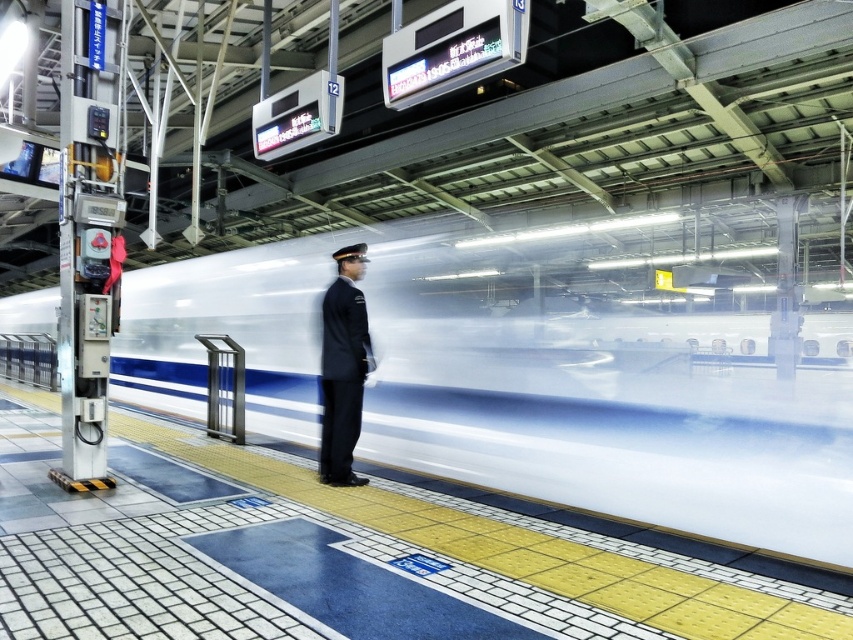
Consider the image. You are a visually impaired person using a cane to navigate the train station platform. You feel the yellow tactile paving at center and the dark blue uniform at center nearby. Which object is wider under your feet?

The yellow tactile paving at center is wider than the dark blue uniform at center, so the tactile paving would feel wider under your feet.

You are a passenger waiting on the platform. You see the white glossy train at center and the yellow tactile paving at center. Which object is closer to you?

The yellow tactile paving at center is closer to you because it is under the white glossy train at center, indicating it is on the platform where you are standing, while the train is moving past at high speed.